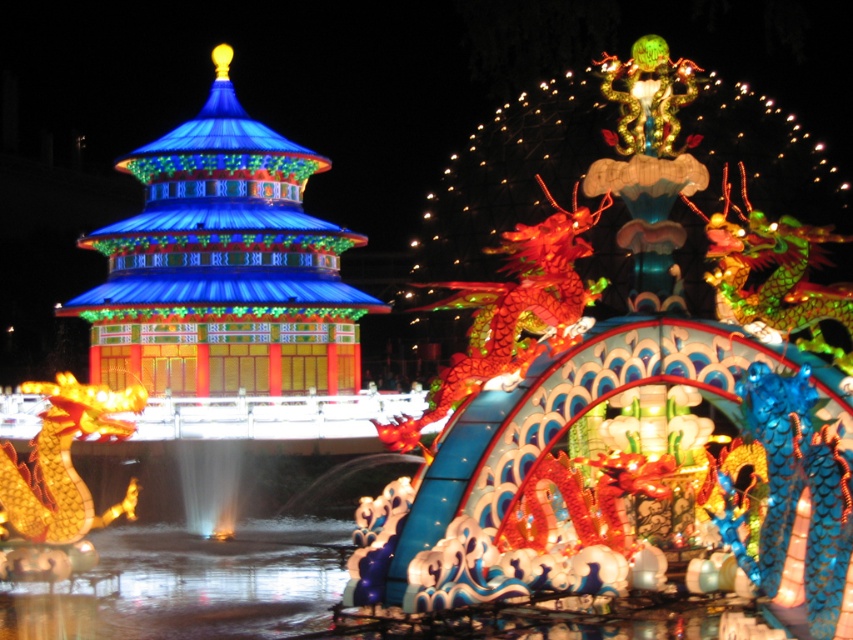
You are a photographer standing at the edge of a lake during a lantern festival. You want to capture both the shiny blue pagoda at center and the clear liquid water at center in a single shot. Which object should you focus on first to ensure both are in frame?

The shiny blue pagoda at center is bigger than the clear liquid water at center, so you should focus on the shiny blue pagoda at center first to ensure both are in frame.